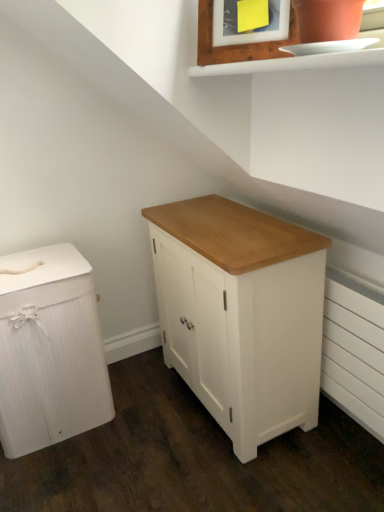
Identify the location of vacant area that lies between white painted wood cabinet at center, marked as the second chest of drawers in a left-to-right arrangement, and white painted radiator at lower right. The width and height of the screenshot is (384, 512). (311, 461).